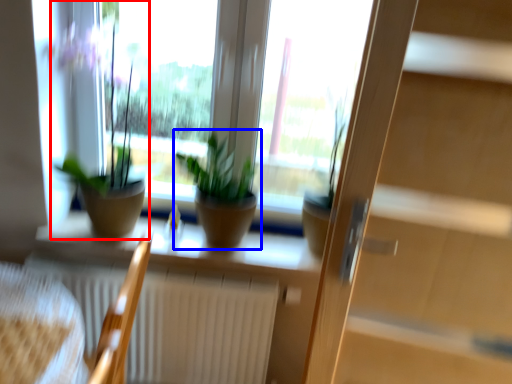
Question: Which object appears closest to the camera in this image, houseplant (highlighted by a red box) or houseplant (highlighted by a blue box)?

Choices:
 (A) houseplant
 (B) houseplant

Answer: (A)